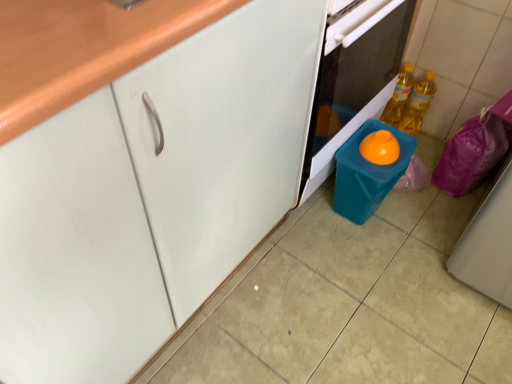
Image resolution: width=512 pixels, height=384 pixels. I want to click on spots to the right of teal plastic container at lower right, so click(424, 219).